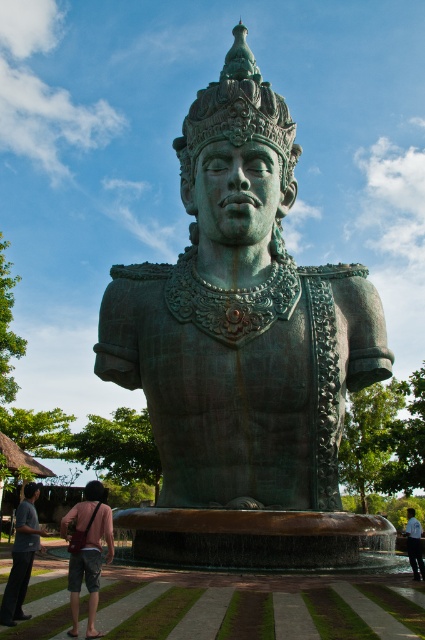
You are a photographer planning to take a photo of the green patina bronze statue at center and the light blue shirt at lower right. To ensure both are in focus, you need to know their relative sizes. Which object is taller?

The green patina bronze statue at center is taller than the light blue shirt at lower right according to the description.

You are a visitor at an outdoor garden and see the green patina bronze statue at center and the pink fabric bag at lower left. Which object is positioned higher in the scene?

The green patina bronze statue at center is located above the pink fabric bag at lower left, so it is positioned higher in the scene.

You are standing in front of the statue and want to place your pink fabric bag at lower left somewhere near the statue. Where should you put it?

The pink fabric bag at lower left should be placed at point [87,552].